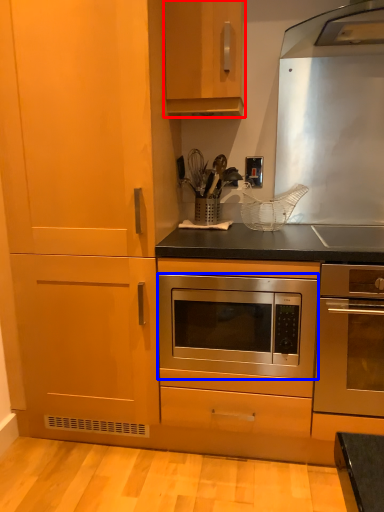
Question: Which point is further to the camera, cabinetry (highlighted by a red box) or oven (highlighted by a blue box)?

Choices:
 (A) cabinetry
 (B) oven

Answer: (A)